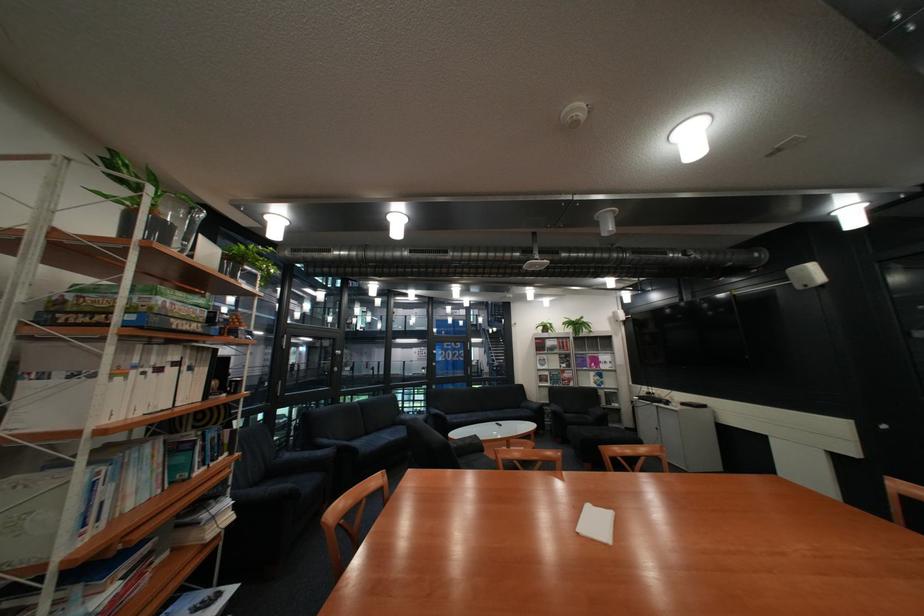
The height and width of the screenshot is (616, 924). I want to click on dark chair sitting surface, so click(x=295, y=477).